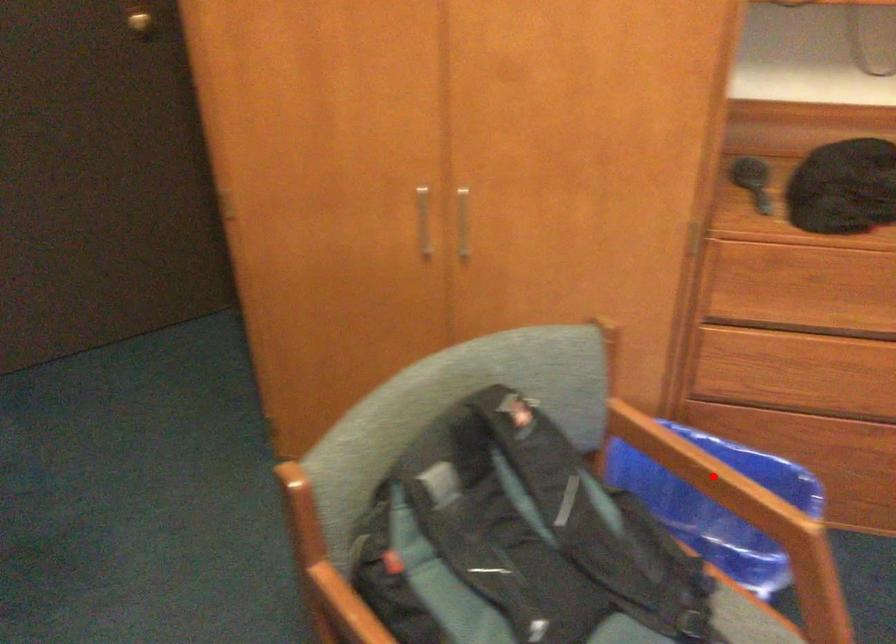
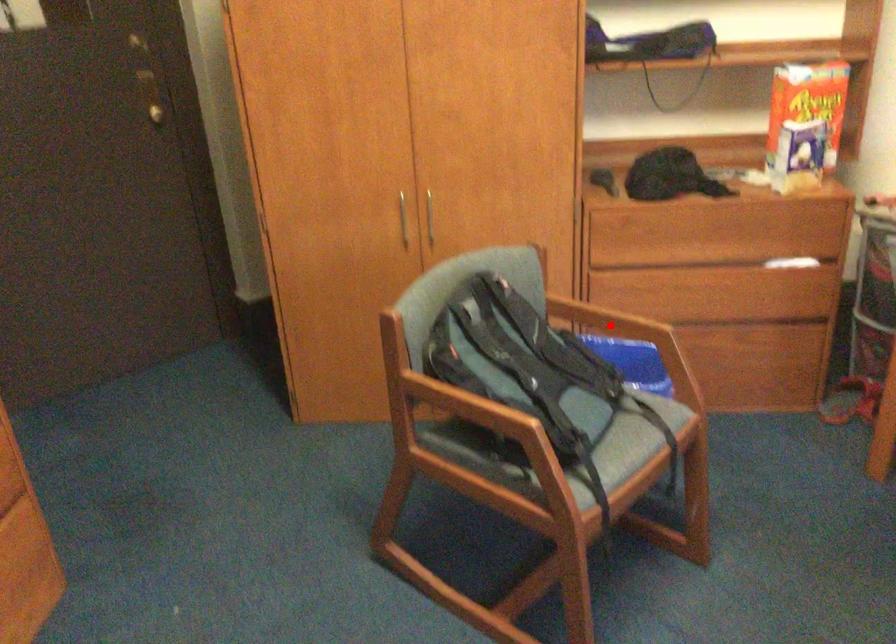
I am providing you with two images of the same scene from different viewpoints. A red point is marked on the first image and another point is marked on the second image. Are the points marked in image1 and image2 representing the same 3D position?

Yes